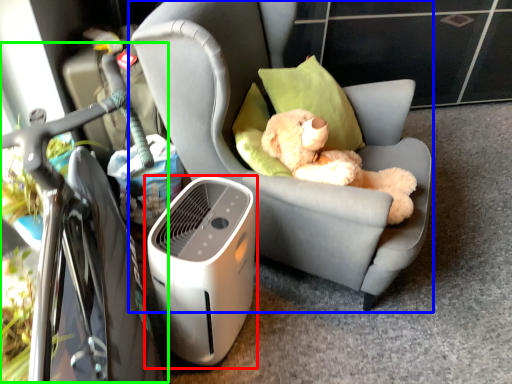
Question: Which object is the closest to the home appliance (highlighted by a red box)? Choose among these: chair (highlighted by a blue box) or bicycle (highlighted by a green box).

Choices:
 (A) chair
 (B) bicycle

Answer: (B)